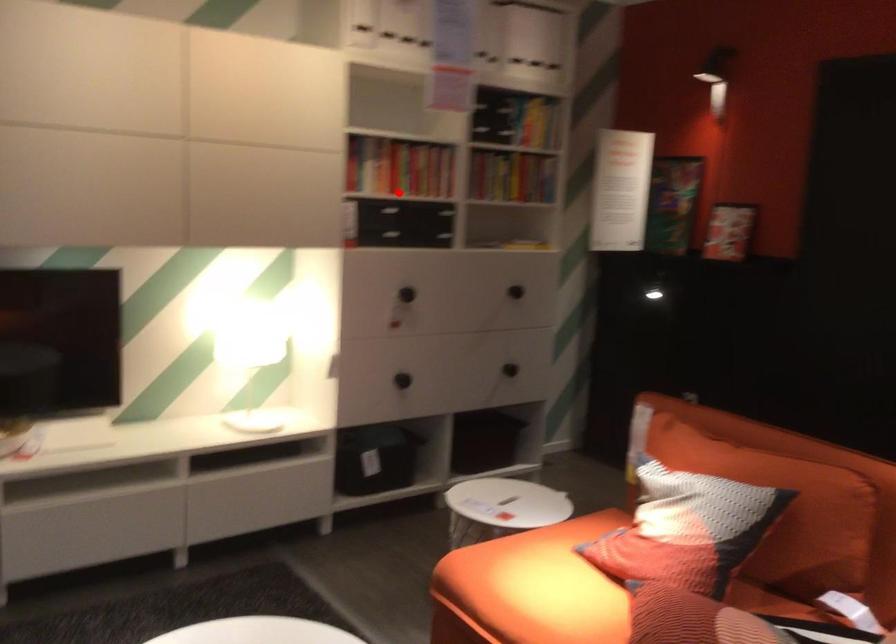
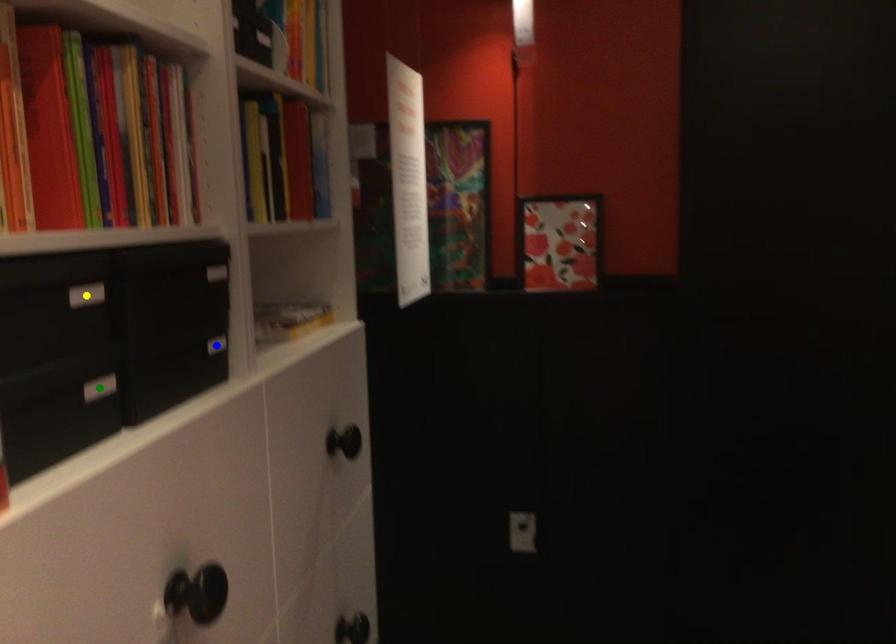
Question: I am providing you with two images of the same scene from different viewpoints. A red point is marked on the first image. You are given multiple points on the second image. Which mark in image 2 goes with the point in image 1?

Choices:
 (A) yellow point
 (B) green point
 (C) blue point

Answer: (A)